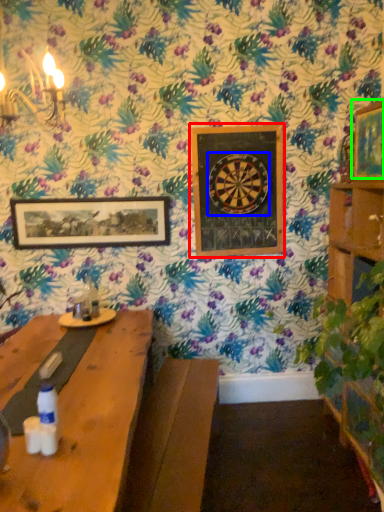
Question: Based on their relative distances, which object is nearer to picture frame (highlighted by a red box)? Choose from design (highlighted by a blue box) and picture frame (highlighted by a green box).

Choices:
 (A) design
 (B) picture frame

Answer: (A)